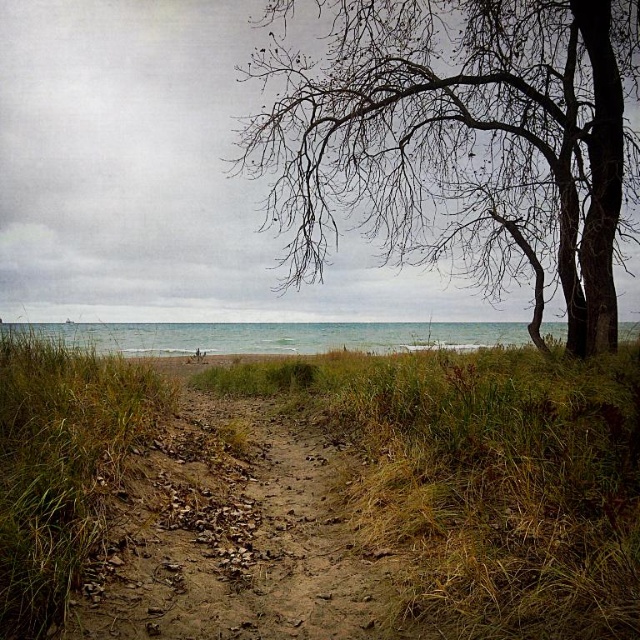
Can you confirm if brown dirt track at center is wider than clear water at lower center?

In fact, brown dirt track at center might be narrower than clear water at lower center.

Can you confirm if brown dirt track at center is smaller than clear water at lower center?

Indeed, brown dirt track at center has a smaller size compared to clear water at lower center.

Identify the location of brown dirt track at center. The image size is (640, 640). (234, 538).

Is bare branches at upper center smaller than clear water at lower center?

Indeed, bare branches at upper center has a smaller size compared to clear water at lower center.

Describe the element at coordinates (458, 140) in the screenshot. I see `bare branches at upper center` at that location.

Which is behind, point (541, 184) or point (122, 333)?

Positioned behind is point (122, 333).

Locate an element on the screen. This screenshot has width=640, height=640. bare branches at upper center is located at coordinates (458, 140).

Is green grass at center taller than brown dirt track at center?

Indeed, green grass at center has a greater height compared to brown dirt track at center.

How much distance is there between green grass at center and brown dirt track at center?

They are 3.62 meters apart.

Which is in front, point (588, 436) or point (218, 408)?

Positioned in front is point (588, 436).

Locate an element on the screen. green grass at center is located at coordinates (486, 477).